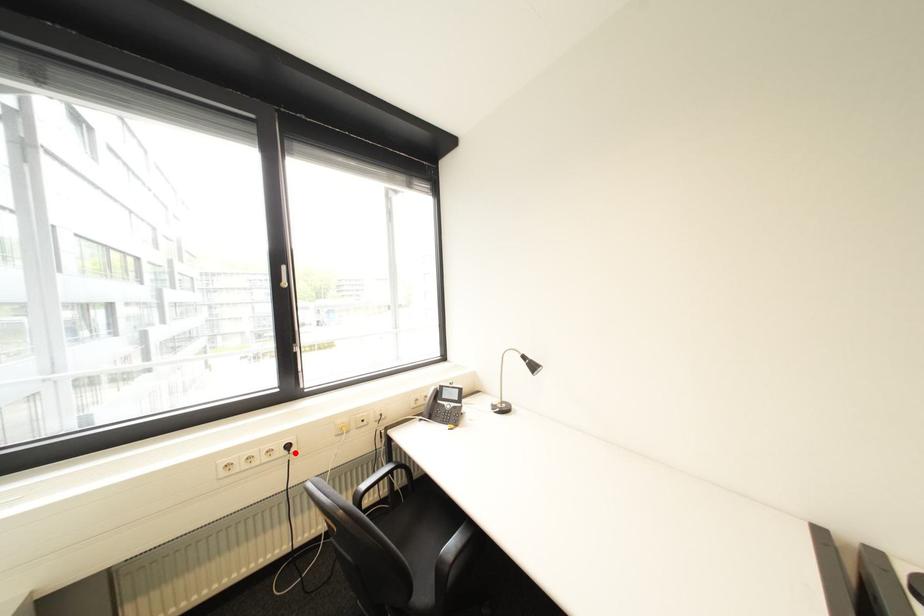
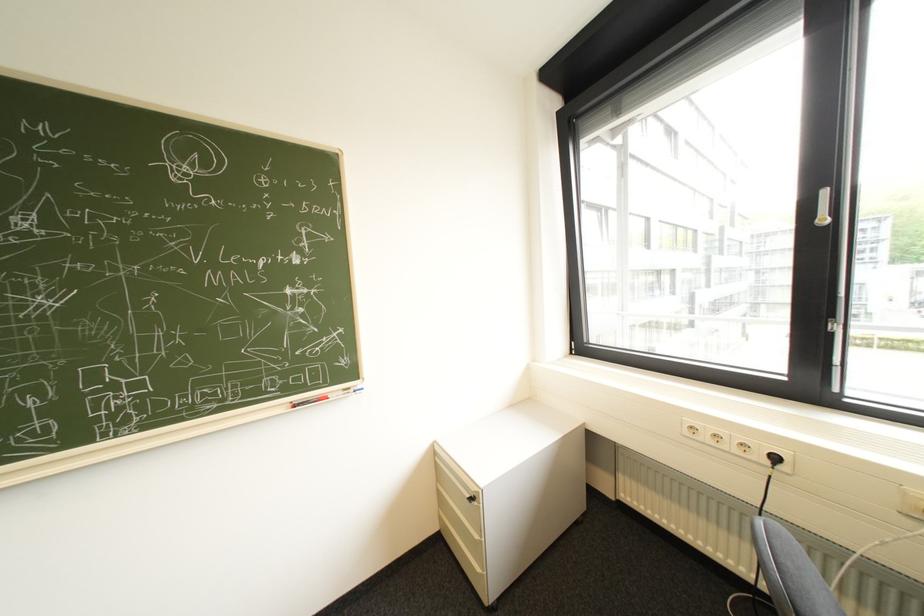
Question: I am providing you with two images of the same scene from different viewpoints. A red point is marked on the first image. Can you still see the location of the red point in image 2?

Choices:
 (A) Yes
 (B) No

Answer: (A)